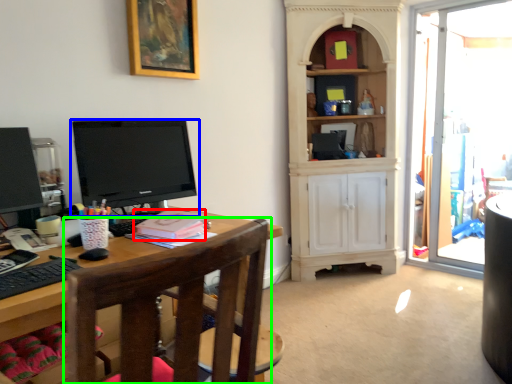
Question: Estimate the real-world distances between objects in this image. Which object is farther from book (highlighted by a red box), television (highlighted by a blue box) or chair (highlighted by a green box)?

Choices:
 (A) television
 (B) chair

Answer: (B)